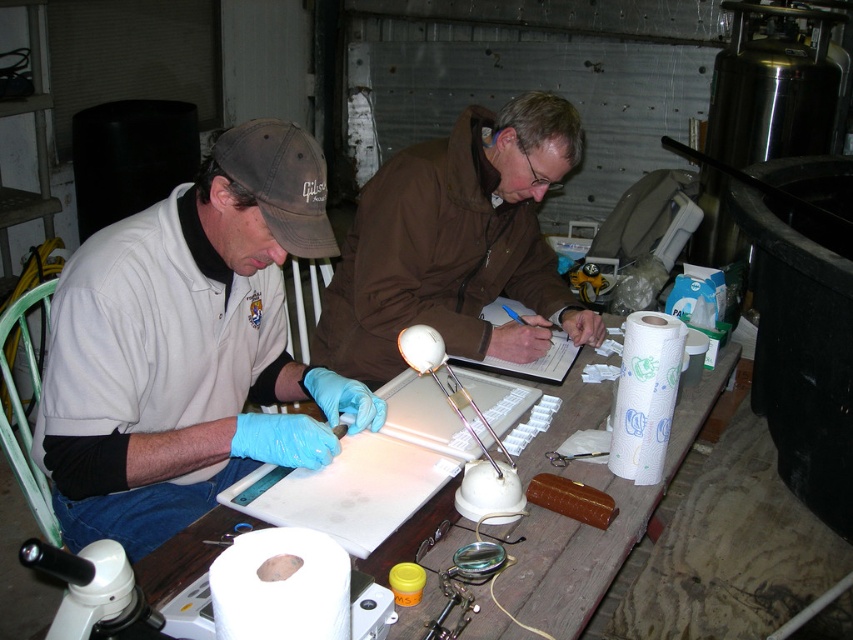
Who is positioned more to the right, brown matte jacket at center or white plastic table at center?

From the viewer's perspective, white plastic table at center appears more on the right side.

Who is more forward, (573,108) or (154,573)?

Point (154,573) is more forward.

Which is behind, point (392, 294) or point (595, 538)?

Positioned behind is point (392, 294).

Locate an element on the screen. The height and width of the screenshot is (640, 853). brown matte jacket at center is located at coordinates pos(457,244).

Who is more forward, (56, 412) or (329, 332)?

Point (56, 412) is more forward.

Is blue latex gloves at left further to camera compared to brown matte jacket at center?

No, it is in front of brown matte jacket at center.

At what (x,y) coordinates should I click in order to perform the action: click on blue latex gloves at left. Please return your answer as a coordinate pair (x, y). Image resolution: width=853 pixels, height=640 pixels. Looking at the image, I should click on (189, 346).

Identify the location of blue latex gloves at left. This screenshot has height=640, width=853. (189, 346).

Does point (102, 397) come behind point (564, 560)?

Yes, it is behind point (564, 560).

Can you confirm if blue latex gloves at left is positioned to the left of white plastic table at center?

Indeed, blue latex gloves at left is positioned on the left side of white plastic table at center.

This screenshot has width=853, height=640. What do you see at coordinates (189, 346) in the screenshot? I see `blue latex gloves at left` at bounding box center [189, 346].

Where is `blue latex gloves at left`? Image resolution: width=853 pixels, height=640 pixels. blue latex gloves at left is located at coordinates (189, 346).